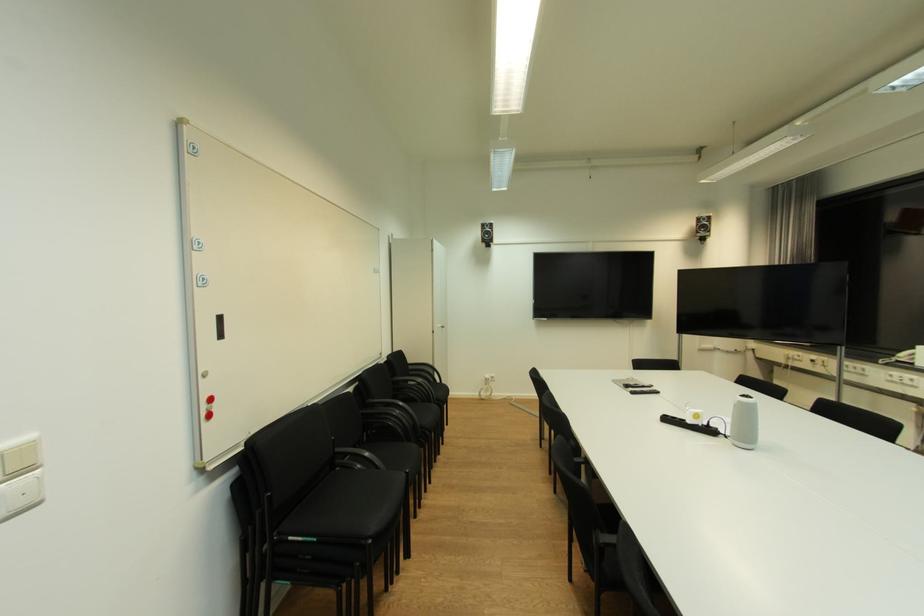
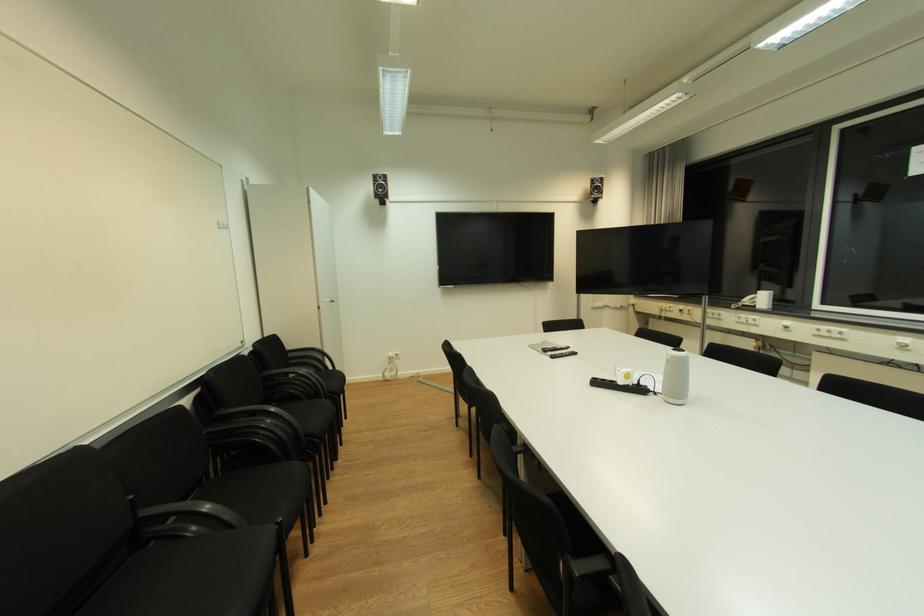
Where in the second image is the point corresponding to (746,403) from the first image?

(678, 358)